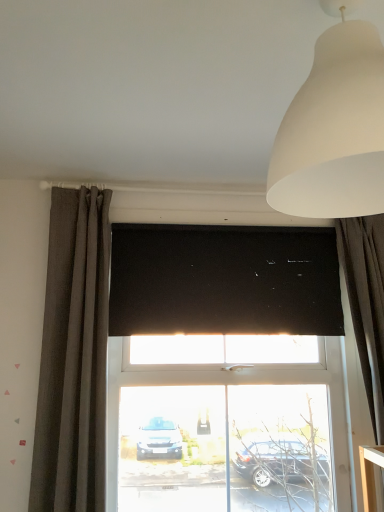
Where is `dark gray textured curtain at left, the 1th curtain viewed from the left`? dark gray textured curtain at left, the 1th curtain viewed from the left is located at coordinates (73, 357).

What do you see at coordinates (366, 303) in the screenshot? The height and width of the screenshot is (512, 384). I see `dark grey fabric curtain at right, the second curtain from the left` at bounding box center [366, 303].

The width and height of the screenshot is (384, 512). I want to click on dark gray textured curtain at left, positioned as the 2th curtain in right-to-left order, so click(x=73, y=357).

Which is in front, point (179, 251) or point (361, 195)?

Positioned in front is point (361, 195).

Can white matte lampshade at upper right be found inside black matte window screen at center?

No, black matte window screen at center does not contain white matte lampshade at upper right.

Considering the sizes of objects black matte window screen at center and white matte lampshade at upper right in the image provided, who is smaller, black matte window screen at center or white matte lampshade at upper right?

black matte window screen at center is smaller.

Is black matte window screen at center next to dark grey fabric curtain at right, the second curtain from the left?

black matte window screen at center is not next to dark grey fabric curtain at right, the second curtain from the left, and they're not touching.

From the image's perspective, would you say black matte window screen at center is shown under dark grey fabric curtain at right, the second curtain from the left?

No, from the image's perspective, black matte window screen at center is not beneath dark grey fabric curtain at right, the second curtain from the left.

Is black matte window screen at center positioned with its back to dark grey fabric curtain at right, the second curtain from the left?

black matte window screen at center does not have its back to dark grey fabric curtain at right, the second curtain from the left.

Locate an element on the screen. This screenshot has width=384, height=512. lamp above the dark gray textured curtain at left, the 1th curtain viewed from the left (from the image's perspective) is located at coordinates (334, 130).

Can you confirm if dark gray textured curtain at left, the 1th curtain viewed from the left, is bigger than white matte lampshade at upper right?

Indeed, dark gray textured curtain at left, the 1th curtain viewed from the left, has a larger size compared to white matte lampshade at upper right.

From the picture: Is dark gray textured curtain at left, positioned as the 2th curtain in right-to-left order, wider or thinner than white matte lampshade at upper right?

Considering their sizes, dark gray textured curtain at left, positioned as the 2th curtain in right-to-left order, looks slimmer than white matte lampshade at upper right.

Consider the image. From the image's perspective, is dark gray textured curtain at left, positioned as the 2th curtain in right-to-left order, under white matte lampshade at upper right?

Indeed, from the image's perspective, dark gray textured curtain at left, positioned as the 2th curtain in right-to-left order, is shown beneath white matte lampshade at upper right.

Is dark grey fabric curtain at right, the first curtain viewed from the right, oriented towards dark gray textured curtain at left, the 1th curtain viewed from the left?

No, dark grey fabric curtain at right, the first curtain viewed from the right, is not oriented towards dark gray textured curtain at left, the 1th curtain viewed from the left.

From the image's perspective, is dark grey fabric curtain at right, the first curtain viewed from the right, under dark gray textured curtain at left, the 1th curtain viewed from the left?

Yes, from the image's perspective, dark grey fabric curtain at right, the first curtain viewed from the right, is below dark gray textured curtain at left, the 1th curtain viewed from the left.

Can we say dark grey fabric curtain at right, the second curtain from the left, lies outside dark gray textured curtain at left, positioned as the 2th curtain in right-to-left order?

Yes, dark grey fabric curtain at right, the second curtain from the left, is outside of dark gray textured curtain at left, positioned as the 2th curtain in right-to-left order.

In the image, there is a dark gray textured curtain at left, positioned as the 2th curtain in right-to-left order. Identify the location of curtain below it (from the image's perspective). The image size is (384, 512). (366, 303).

Where is `curtain on the right of dark gray textured curtain at left, positioned as the 2th curtain in right-to-left order`? This screenshot has width=384, height=512. curtain on the right of dark gray textured curtain at left, positioned as the 2th curtain in right-to-left order is located at coordinates (366, 303).

Is the depth of dark gray textured curtain at left, the 1th curtain viewed from the left, greater than that of dark grey fabric curtain at right, the second curtain from the left?

No, dark gray textured curtain at left, the 1th curtain viewed from the left, is in front of dark grey fabric curtain at right, the second curtain from the left.

Does dark gray textured curtain at left, positioned as the 2th curtain in right-to-left order, have a lesser width compared to dark grey fabric curtain at right, the first curtain viewed from the right?

No, dark gray textured curtain at left, positioned as the 2th curtain in right-to-left order, is not thinner than dark grey fabric curtain at right, the first curtain viewed from the right.

Is dark gray textured curtain at left, the 1th curtain viewed from the left, taller or shorter than dark grey fabric curtain at right, the second curtain from the left?

Clearly, dark gray textured curtain at left, the 1th curtain viewed from the left, is taller compared to dark grey fabric curtain at right, the second curtain from the left.

Is white matte lampshade at upper right further to camera compared to dark gray textured curtain at left, positioned as the 2th curtain in right-to-left order?

No, white matte lampshade at upper right is closer to the viewer.

Is white matte lampshade at upper right at the left side of dark gray textured curtain at left, the 1th curtain viewed from the left?

No.

Between point (288, 191) and point (56, 333), which one is positioned in front?

The point (288, 191) is closer.

Is white matte lampshade at upper right bigger or smaller than dark gray textured curtain at left, the 1th curtain viewed from the left?

Clearly, white matte lampshade at upper right is smaller in size than dark gray textured curtain at left, the 1th curtain viewed from the left.

From a real-world perspective, is dark grey fabric curtain at right, the second curtain from the left, above or below white matte lampshade at upper right?

From a real-world perspective, dark grey fabric curtain at right, the second curtain from the left, is physically below white matte lampshade at upper right.

Are dark grey fabric curtain at right, the second curtain from the left, and white matte lampshade at upper right making contact?

dark grey fabric curtain at right, the second curtain from the left, and white matte lampshade at upper right are clearly separated.

Is dark grey fabric curtain at right, the first curtain viewed from the right, oriented away from white matte lampshade at upper right?

No, dark grey fabric curtain at right, the first curtain viewed from the right, is not facing the opposite direction of white matte lampshade at upper right.

Is dark grey fabric curtain at right, the first curtain viewed from the right, at the right side of white matte lampshade at upper right?

Yes, dark grey fabric curtain at right, the first curtain viewed from the right, is to the right of white matte lampshade at upper right.

Where is `lamp in front of the black matte window screen at center`? The image size is (384, 512). lamp in front of the black matte window screen at center is located at coordinates (334, 130).

From a real-world perspective, which curtain is the 2nd one underneath the black matte window screen at center? Please provide its 2D coordinates.

[(366, 303)]

Considering their positions, is white matte lampshade at upper right positioned further to dark grey fabric curtain at right, the second curtain from the left, than black matte window screen at center?

white matte lampshade at upper right lies further to dark grey fabric curtain at right, the second curtain from the left, than the other object.

Looking at the image, which one is located closer to black matte window screen at center, dark grey fabric curtain at right, the first curtain viewed from the right, or dark gray textured curtain at left, the 1th curtain viewed from the left?

Based on the image, dark grey fabric curtain at right, the first curtain viewed from the right, appears to be nearer to black matte window screen at center.

From the picture: From the image, which object appears to be farther from dark gray textured curtain at left, the 1th curtain viewed from the left, white matte lampshade at upper right or dark grey fabric curtain at right, the second curtain from the left?

The object further to dark gray textured curtain at left, the 1th curtain viewed from the left, is white matte lampshade at upper right.

Looking at the image, which one is located further to white matte lampshade at upper right, black matte window screen at center or dark grey fabric curtain at right, the first curtain viewed from the right?

dark grey fabric curtain at right, the first curtain viewed from the right, lies further to white matte lampshade at upper right than the other object.

Based on their spatial positions, is black matte window screen at center or dark gray textured curtain at left, positioned as the 2th curtain in right-to-left order, closer to dark grey fabric curtain at right, the first curtain viewed from the right?

The object closer to dark grey fabric curtain at right, the first curtain viewed from the right, is black matte window screen at center.

Considering their positions, is dark grey fabric curtain at right, the first curtain viewed from the right, positioned further to white matte lampshade at upper right than black matte window screen at center?

Among the two, dark grey fabric curtain at right, the first curtain viewed from the right, is located further to white matte lampshade at upper right.

Based on their spatial positions, is dark gray textured curtain at left, the 1th curtain viewed from the left, or dark grey fabric curtain at right, the second curtain from the left, further from white matte lampshade at upper right?

dark gray textured curtain at left, the 1th curtain viewed from the left, is positioned further to the anchor white matte lampshade at upper right.

Based on their spatial positions, is dark grey fabric curtain at right, the second curtain from the left, or white matte lampshade at upper right closer to black matte window screen at center?

Among the two, dark grey fabric curtain at right, the second curtain from the left, is located nearer to black matte window screen at center.

The image size is (384, 512). What are the coordinates of `lamp situated between dark gray textured curtain at left, the 1th curtain viewed from the left, and dark grey fabric curtain at right, the second curtain from the left, from left to right` in the screenshot? It's located at (334, 130).

Where is `window screen located between dark gray textured curtain at left, the 1th curtain viewed from the left, and dark grey fabric curtain at right, the second curtain from the left, in the left-right direction`? window screen located between dark gray textured curtain at left, the 1th curtain viewed from the left, and dark grey fabric curtain at right, the second curtain from the left, in the left-right direction is located at coordinates (224, 280).